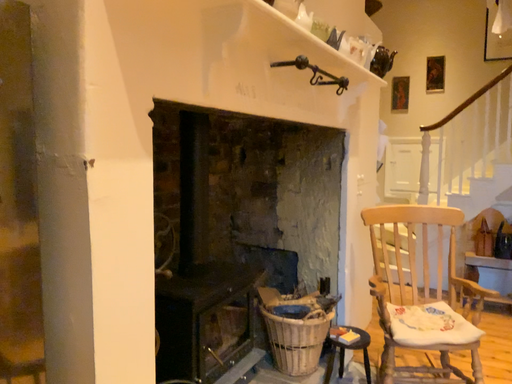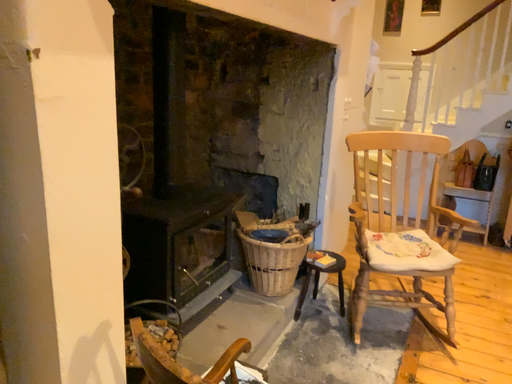
Question: Which way did the camera rotate in the video?

Choices:
 (A) rotated upward
 (B) rotated downward

Answer: (B)